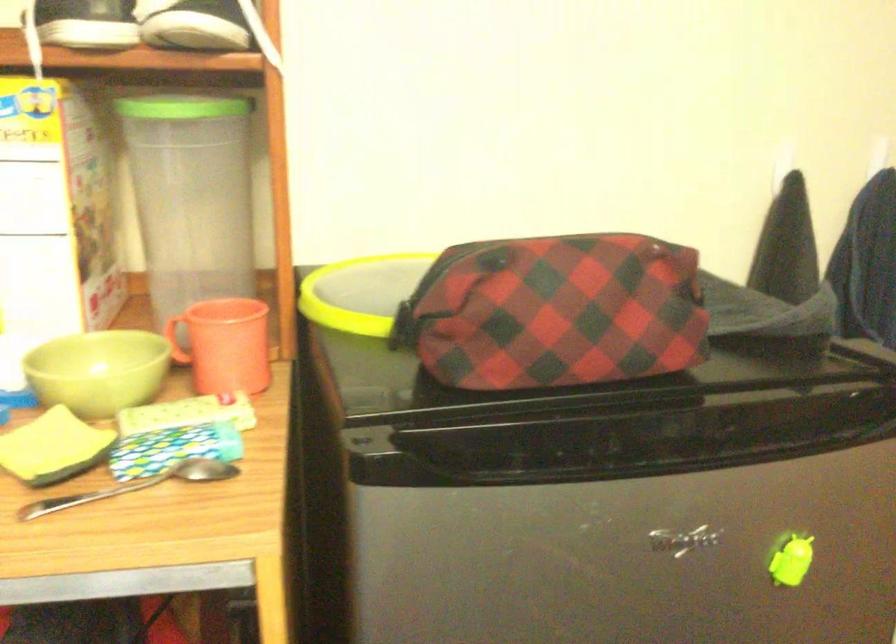
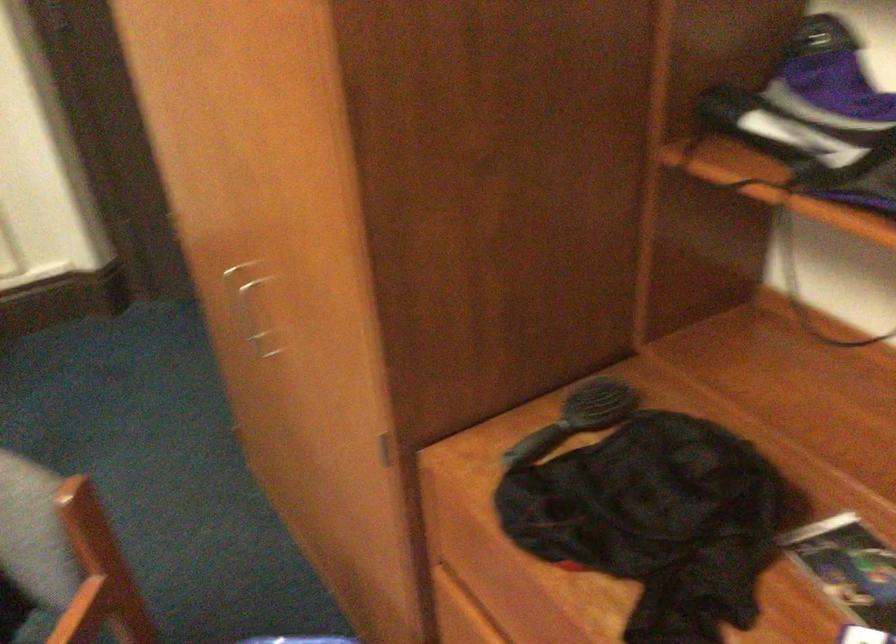
Which direction would the cameraman need to move to produce the second image?

The cameraman walked toward right, backward.